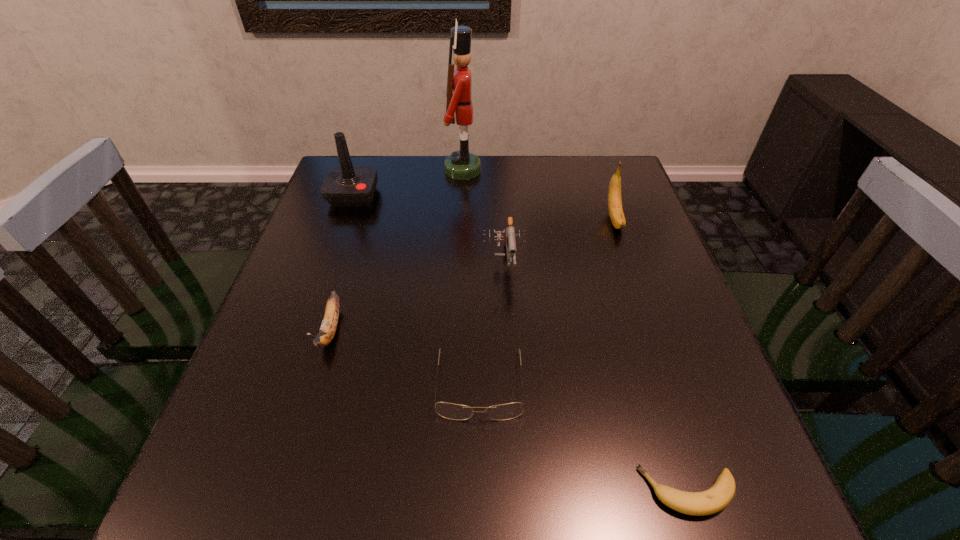
Identify the location of the tallest object. [461, 165].

Locate an element on the screen. nutcracker is located at coordinates (461, 165).

Identify the location of joystick. coord(346,186).

This screenshot has height=540, width=960. Identify the location of the fifth shortest object. (617, 217).

Where is `the farthest banana`? the farthest banana is located at coordinates (617, 217).

Image resolution: width=960 pixels, height=540 pixels. In order to click on gun in this screenshot , I will do `click(509, 239)`.

Find the location of a particular element. The image size is (960, 540). the fourth farthest object is located at coordinates (509, 239).

Find the location of `the third shortest object`. the third shortest object is located at coordinates (328, 327).

Locate an element on the screen. The image size is (960, 540). the second shortest banana is located at coordinates (328, 327).

Locate an element on the screen. spectacles is located at coordinates (x=501, y=412).